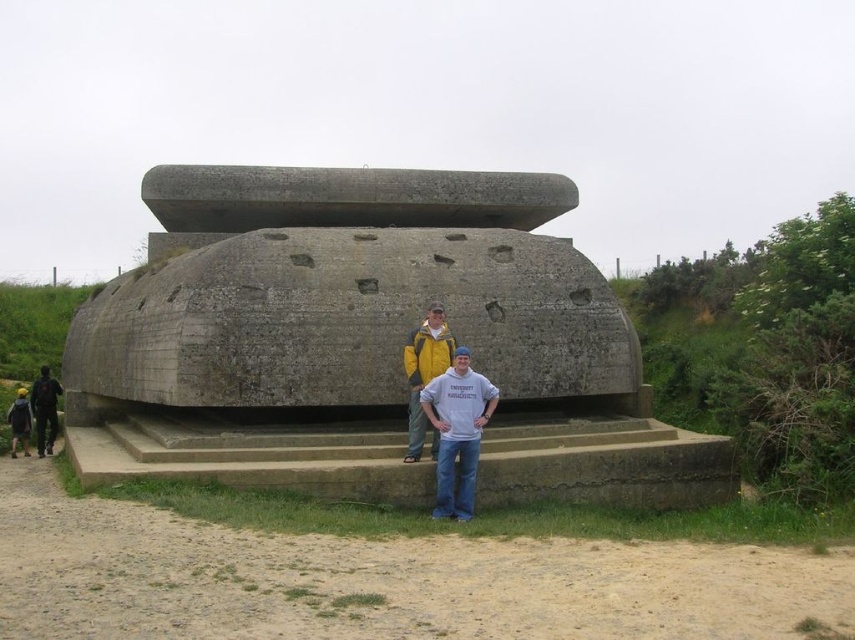
Is concrete bunker at center positioned at the back of white cotton t-shirt at center?

No, concrete bunker at center is in front of white cotton t-shirt at center.

Is point (228, 224) closer to camera compared to point (449, 376)?

That is False.

Locate an element on the screen. This screenshot has height=640, width=855. concrete bunker at center is located at coordinates (366, 342).

Between white cotton t-shirt at center and dark blue jacket at lower left, which one is positioned lower?

dark blue jacket at lower left is below.

Looking at this image, does white cotton t-shirt at center come in front of dark blue jacket at lower left?

That is True.

Who is more forward, (461, 355) or (25, 442)?

Positioned in front is point (461, 355).

Find the location of a particular element. Image resolution: width=855 pixels, height=640 pixels. white cotton t-shirt at center is located at coordinates (446, 412).

Which is more to the right, white cotton t-shirt at center or matte gray concrete statue at center?

Positioned to the right is white cotton t-shirt at center.

Between point (469, 483) and point (441, 364), which one is positioned in front?

Point (469, 483)

The image size is (855, 640). Identify the location of white cotton t-shirt at center. (446, 412).